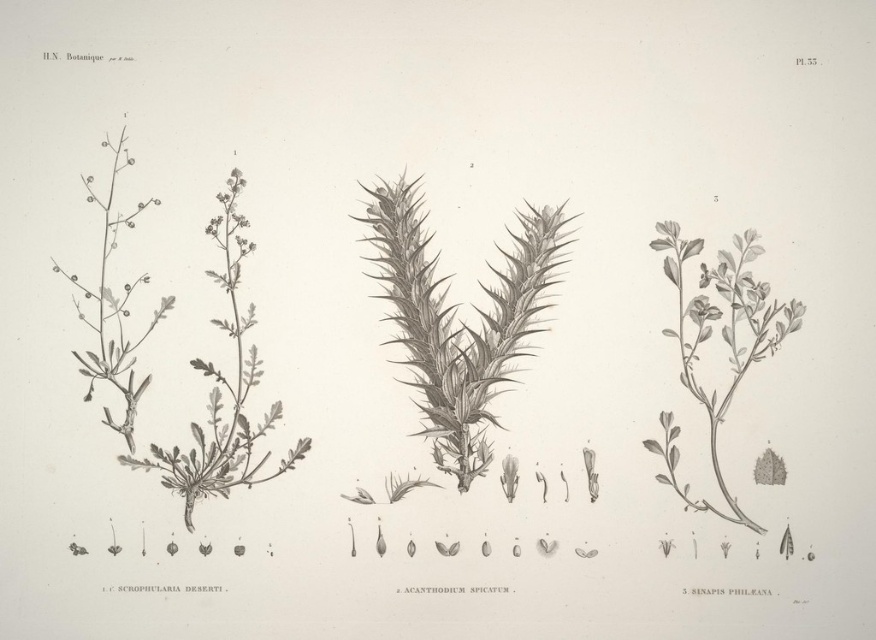
Question: Is gray textured plant at center above green leafy plant at center right?

Choices:
 (A) no
 (B) yes

Answer: (B)

Question: Among these objects, which one is farthest from the camera?

Choices:
 (A) gray textured plant at center
 (B) green leafy plant at center right

Answer: (A)

Question: Can you confirm if gray textured plant at center is positioned to the right of green leafy plant at center right?

Choices:
 (A) yes
 (B) no

Answer: (B)

Question: Is gray textured plant at center to the right of green leafy plant at center right from the viewer's perspective?

Choices:
 (A) no
 (B) yes

Answer: (A)

Question: Which point is farther to the camera?

Choices:
 (A) pos(372,225)
 (B) pos(665,243)

Answer: (A)